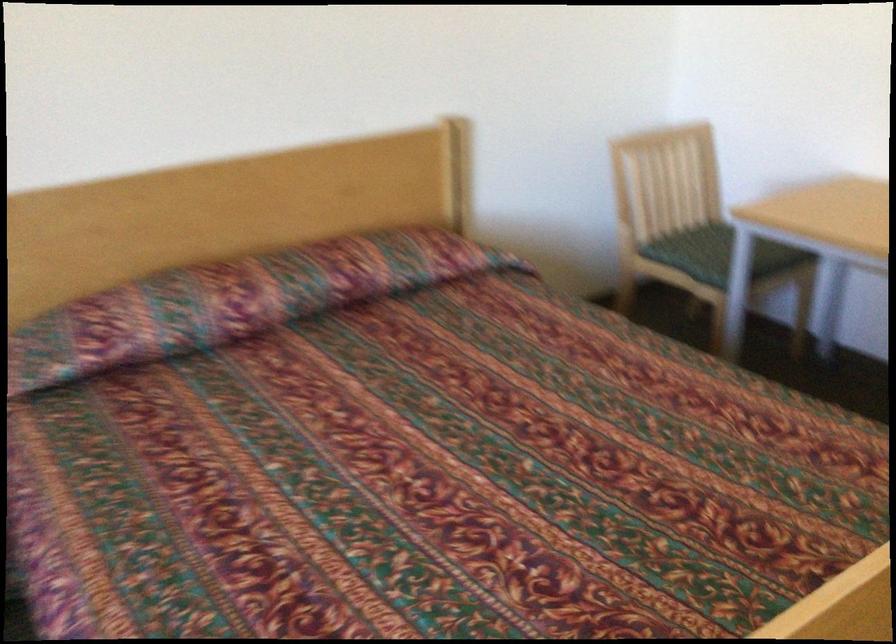
What are the coordinates of `chair sitting surface` in the screenshot? It's located at (710, 243).